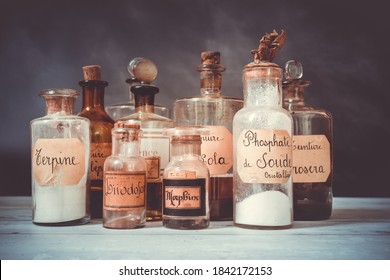
The height and width of the screenshot is (280, 390). Identify the location of cork. (93, 73), (216, 53), (261, 62), (122, 124), (58, 96), (180, 138), (143, 95).